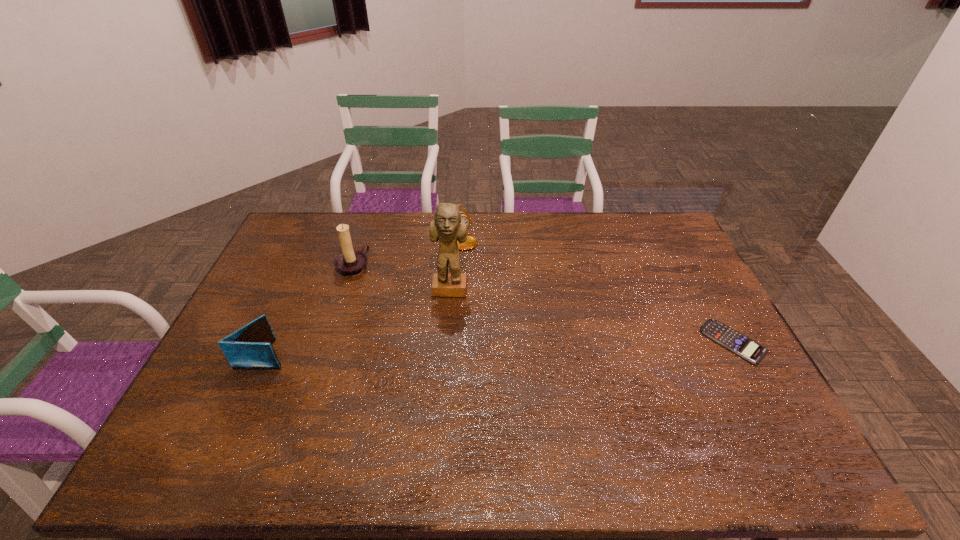
At what (x,y) coordinates should I click in order to perform the action: click on empty space that is in between the leftmost object and the shortest object. Please return your answer as a coordinate pair (x, y). The height and width of the screenshot is (540, 960). Looking at the image, I should click on (499, 348).

Find the location of `blank region between the fourth tallest object and the third shortest object`. blank region between the fourth tallest object and the third shortest object is located at coordinates (368, 296).

The image size is (960, 540). What are the coordinates of `vacant space in between the third shortest object and the leftmost object` in the screenshot? It's located at (368, 296).

Find the location of a particular element. This screenshot has width=960, height=540. empty location between the rightmost object and the fourth tallest object is located at coordinates (499, 348).

You are a GUI agent. You are given a task and a screenshot of the screen. Output one action in this format:
    pyautogui.click(x=<x>, y=<y>)
    Task: Click on the free space between the second tallest object and the fourth tallest object
    The height and width of the screenshot is (540, 960).
    Given the screenshot: What is the action you would take?
    pyautogui.click(x=309, y=310)

Locate an element on the screen. The image size is (960, 540). vacant area that lies between the farthest object and the rightmost object is located at coordinates (602, 290).

Where is `free point between the wallet and the rightmost object`? This screenshot has height=540, width=960. free point between the wallet and the rightmost object is located at coordinates (499, 348).

The width and height of the screenshot is (960, 540). What are the coordinates of `free area in between the fourth shortest object and the third farthest object` in the screenshot? It's located at (401, 279).

At what (x,y) coordinates should I click in order to perform the action: click on free area in between the leftmost object and the calculator. Please return your answer as a coordinate pair (x, y). The image size is (960, 540). Looking at the image, I should click on (499, 348).

Identify which object is located as the nearest to the third farthest object. Please provide its 2D coordinates. Your answer should be formatted as a tuple, i.e. [(x, y)], where the tuple contains the x and y coordinates of a point satisfying the conditions above.

[(471, 242)]